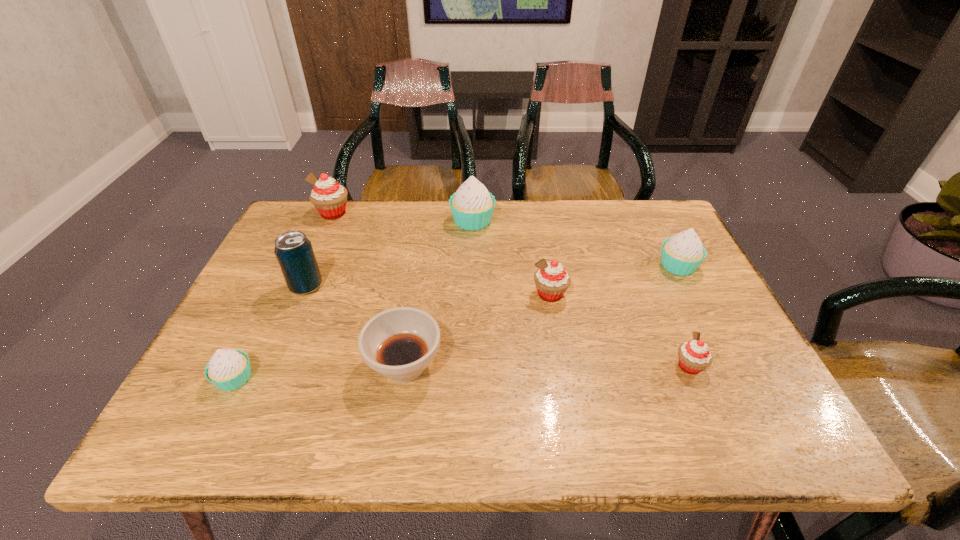
Identify the location of the nearest pink cupcake. (694, 356).

Locate an element on the screen. The width and height of the screenshot is (960, 540). the rightmost pink cupcake is located at coordinates [x=694, y=356].

Identify the location of the smallest white cupcake. (228, 369).

Find the location of a particular element. the nearest white cupcake is located at coordinates (228, 369).

Identify the location of free region located on the right of the farthest pink cupcake. (442, 213).

Where is `free region located on the front of the biggest white cupcake`? Image resolution: width=960 pixels, height=540 pixels. free region located on the front of the biggest white cupcake is located at coordinates (470, 306).

Where is `vacant area located 0.140m on the back of the soda can`? This screenshot has height=540, width=960. vacant area located 0.140m on the back of the soda can is located at coordinates (325, 243).

This screenshot has height=540, width=960. Identify the location of vacant space located 0.180m on the front of the rightmost white cupcake. (712, 333).

Identify the location of blank area located 0.270m on the back of the third object from right to left. Image resolution: width=960 pixels, height=540 pixels. (538, 221).

I want to click on vacant space located on the back of the soup bowl, so tap(424, 235).